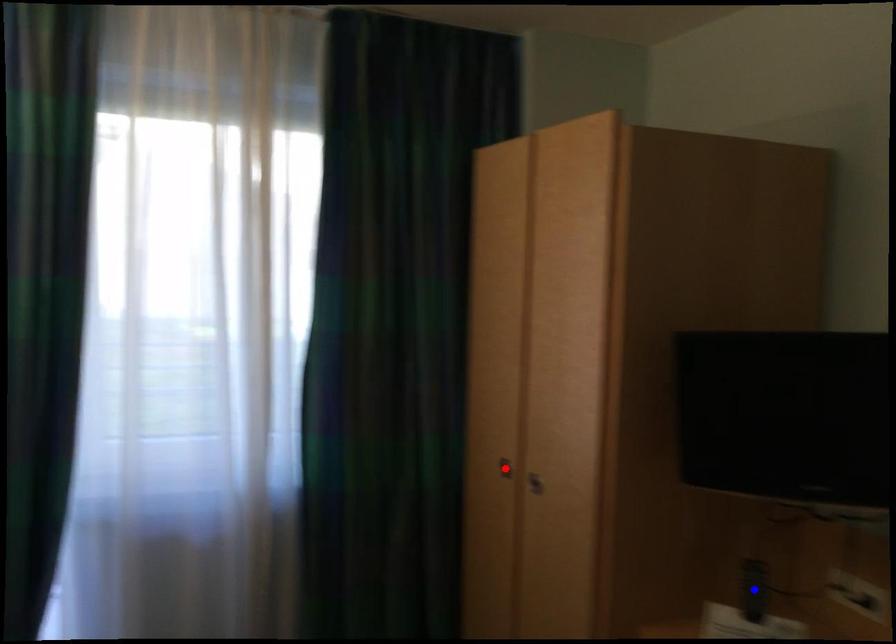
Question: In the image, two points are highlighted. Which point is nearer to the camera? Reply with the corresponding letter.

Choices:
 (A) blue point
 (B) red point

Answer: (A)